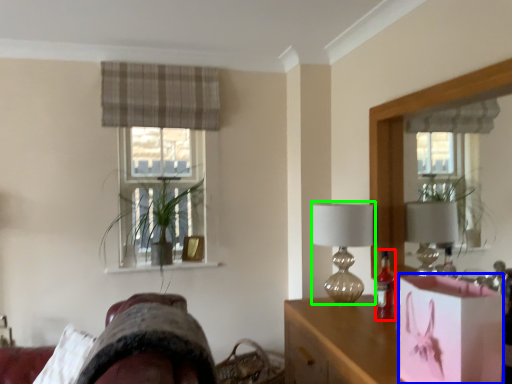
Question: Considering the real-world distances, which object is closest to bottle (highlighted by a red box)? box (highlighted by a blue box) or table lamp (highlighted by a green box).

Choices:
 (A) box
 (B) table lamp

Answer: (B)